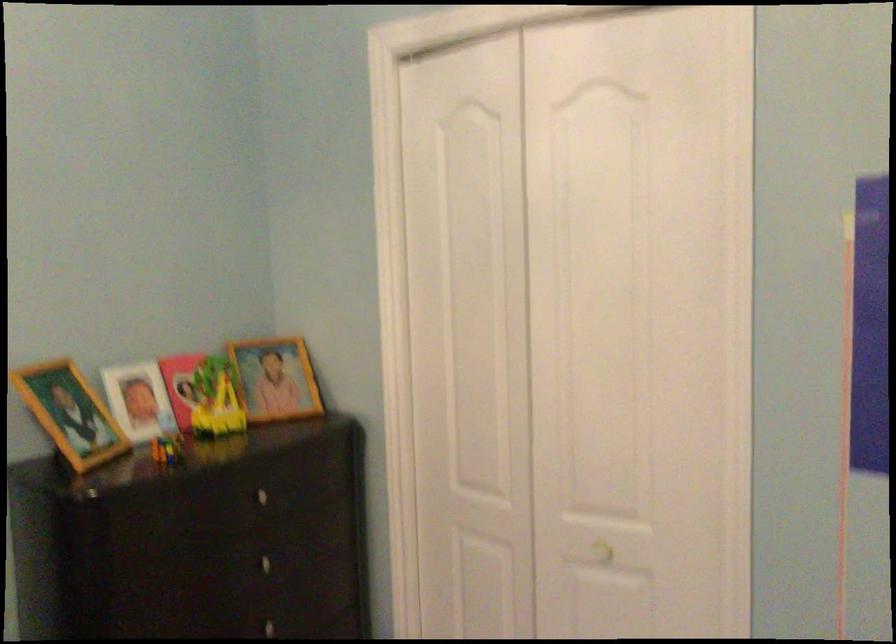
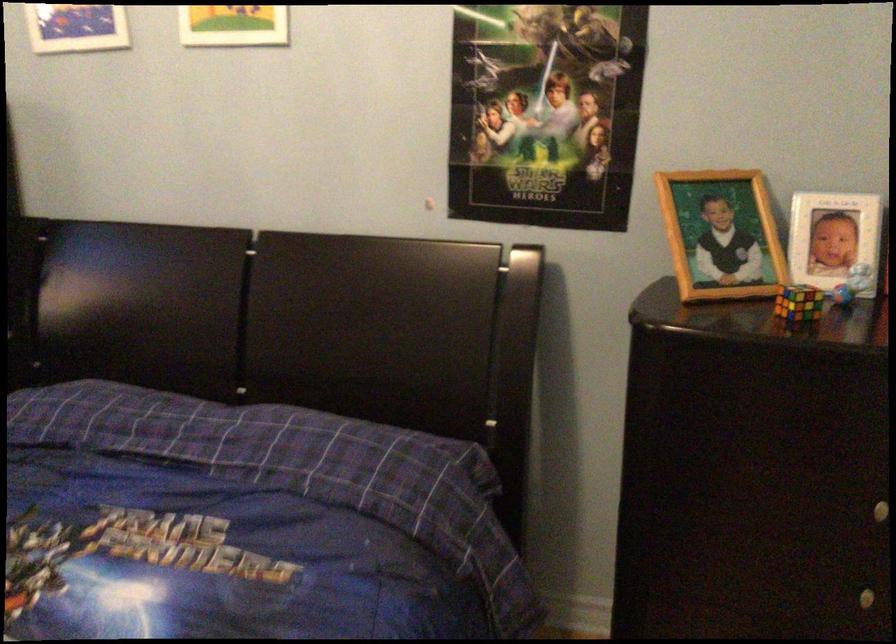
The point at (165, 422) is marked in the first image. Where is the corresponding point in the second image?

(851, 283)